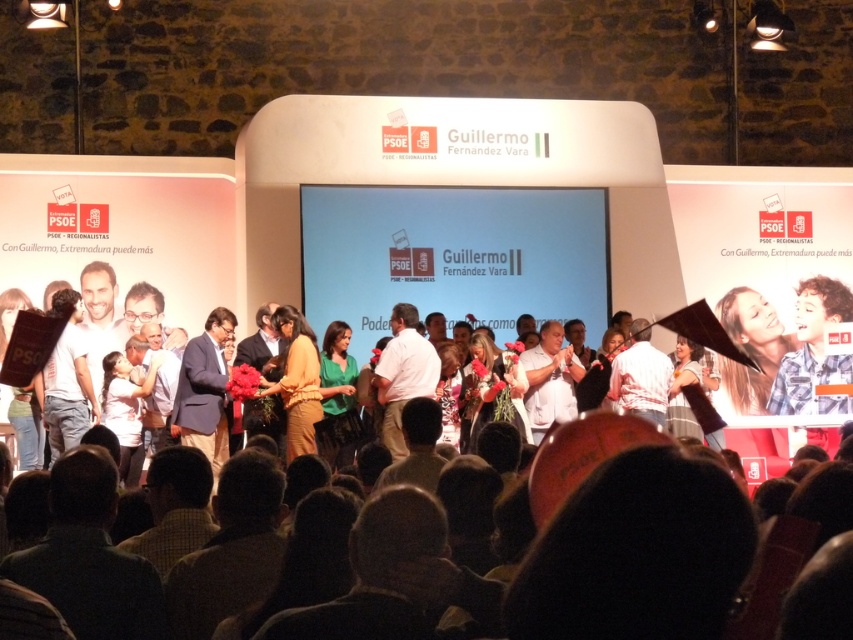
Question: Which point is closer to the camera?

Choices:
 (A) white cotton shirt at center
 (B) green matte shirt at center

Answer: (B)

Question: Does green matte shirt at center appear on the right side of white cotton shirt at center?

Choices:
 (A) no
 (B) yes

Answer: (A)

Question: Can you confirm if matte yellow dress at center is thinner than white cotton shirt at center?

Choices:
 (A) yes
 (B) no

Answer: (A)

Question: Which object is the closest to the matte yellow dress at center?

Choices:
 (A) white cotton shirt at center
 (B) green matte shirt at center

Answer: (B)

Question: Among these objects, which one is farthest from the camera?

Choices:
 (A) green matte shirt at center
 (B) matte yellow dress at center

Answer: (B)

Question: From the image, what is the correct spatial relationship of matte yellow dress at center in relation to green matte shirt at center?

Choices:
 (A) left
 (B) right

Answer: (A)